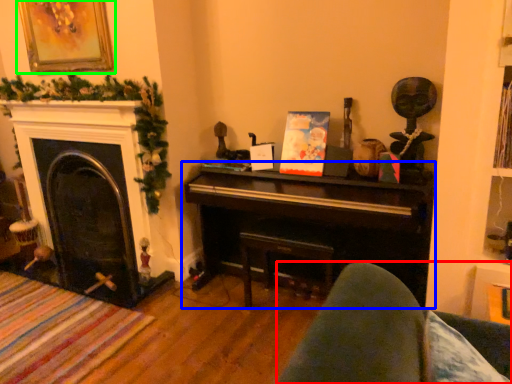
Question: Estimate the real-world distances between objects in this image. Which object is closer to rocking chair (highlighted by a red box), piano (highlighted by a blue box) or picture frame (highlighted by a green box)?

Choices:
 (A) piano
 (B) picture frame

Answer: (A)